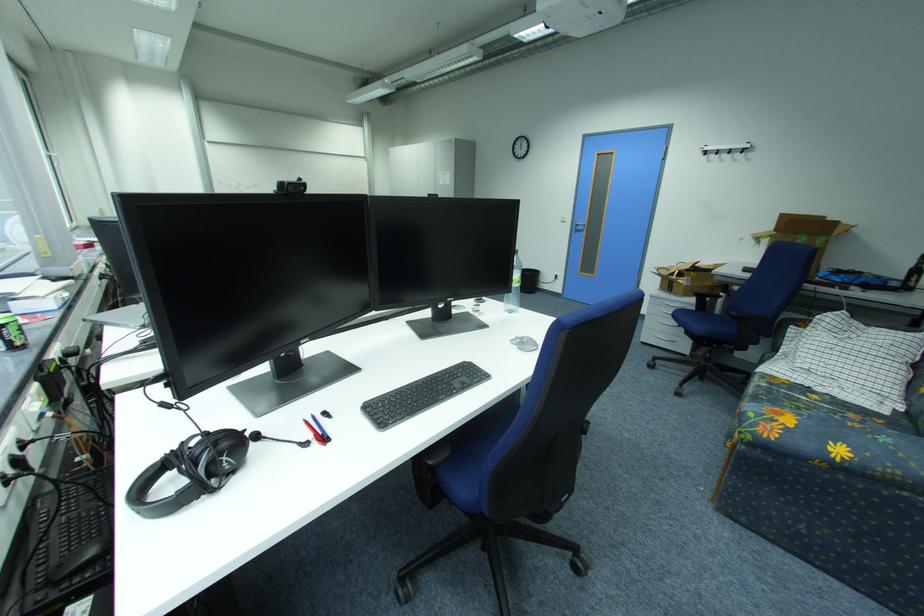
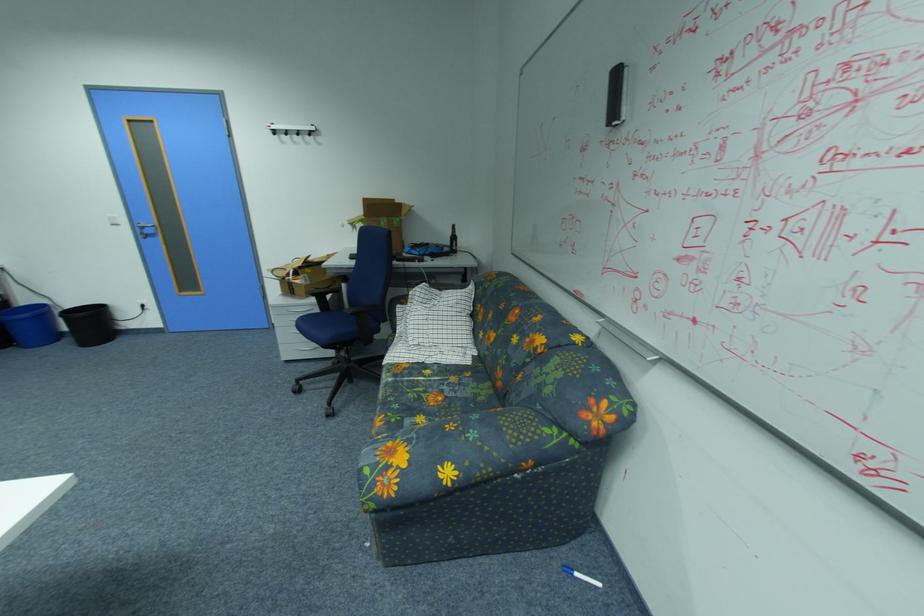
Question: The camera is either moving clockwise (left) or counter-clockwise (right) around the object. The first image is from the beginning of the video and the second image is from the end. Is the camera moving left or right when shooting the video?

Choices:
 (A) Left
 (B) Right

Answer: (A)